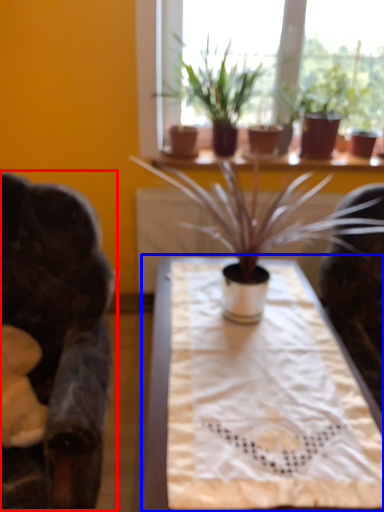
Question: Among these objects, which one is nearest to the camera, rocking chair (highlighted by a red box) or table (highlighted by a blue box)?

Choices:
 (A) rocking chair
 (B) table

Answer: (A)